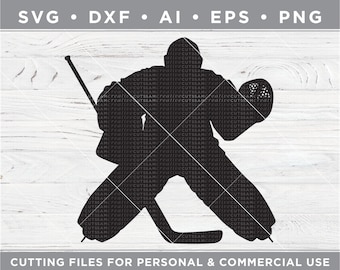
This screenshot has height=270, width=340. What are the coordinates of `wood panel` in the screenshot? It's located at (50, 78).